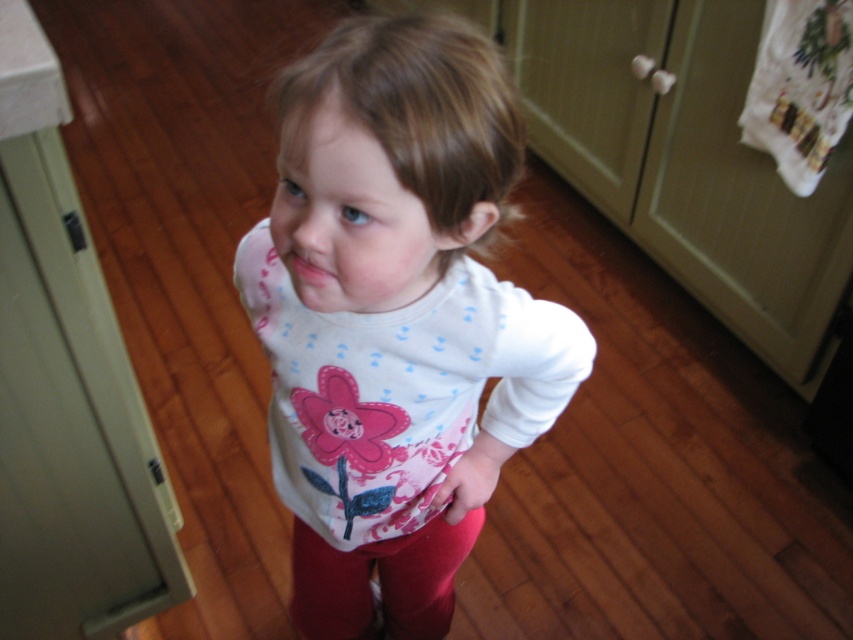
Question: Does white soft shirt at center lie in front of pink matte lips at center?

Choices:
 (A) no
 (B) yes

Answer: (B)

Question: Among these objects, which one is nearest to the camera?

Choices:
 (A) white soft shirt at center
 (B) pink matte lips at center

Answer: (A)

Question: Among these objects, which one is farthest from the camera?

Choices:
 (A) smooth skin face at center
 (B) pink matte lips at center
 (C) white soft shirt at center

Answer: (B)

Question: Which of the following is the closest to the observer?

Choices:
 (A) white soft shirt at center
 (B) smooth skin face at center
 (C) pink matte lips at center

Answer: (A)

Question: In this image, where is white soft shirt at center located relative to pink matte lips at center?

Choices:
 (A) below
 (B) above

Answer: (A)

Question: In this image, where is white soft shirt at center located relative to smooth skin face at center?

Choices:
 (A) above
 (B) below

Answer: (B)